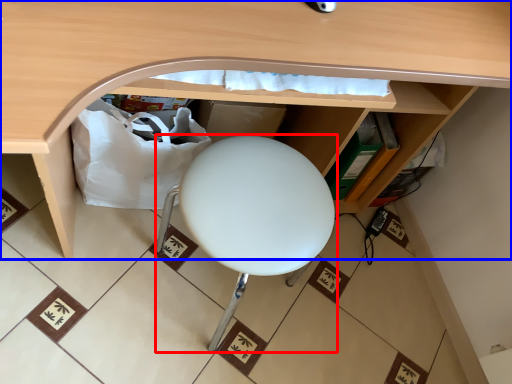
Question: Which object is further to the camera taking this photo, furniture (highlighted by a red box) or desk (highlighted by a blue box)?

Choices:
 (A) furniture
 (B) desk

Answer: (A)